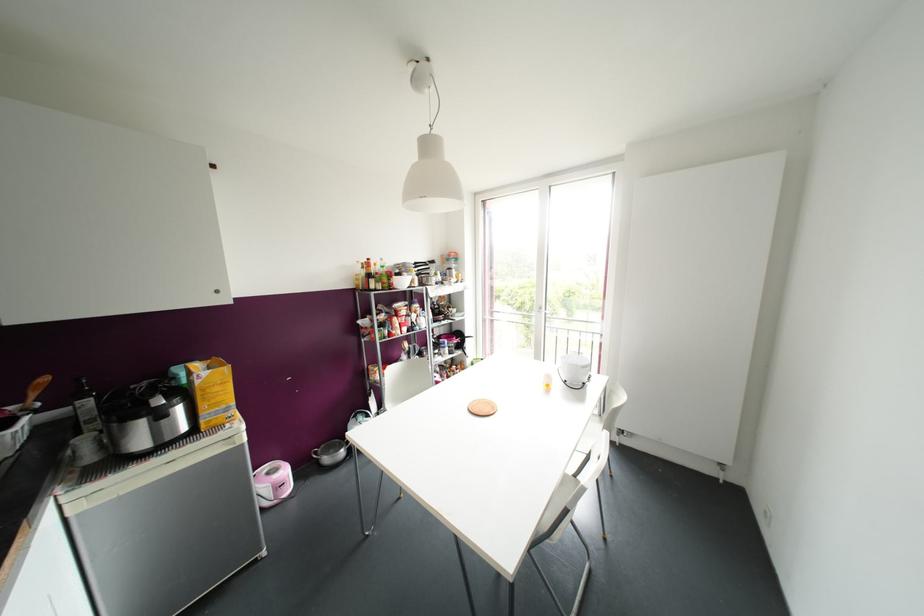
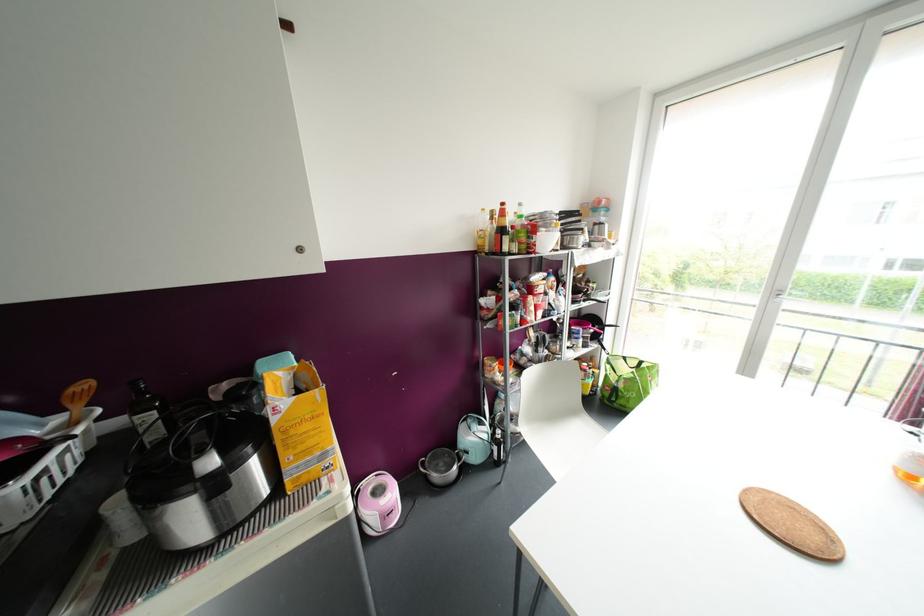
Where in the second image is the point corresponding to (x=285, y=471) from the first image?

(392, 493)